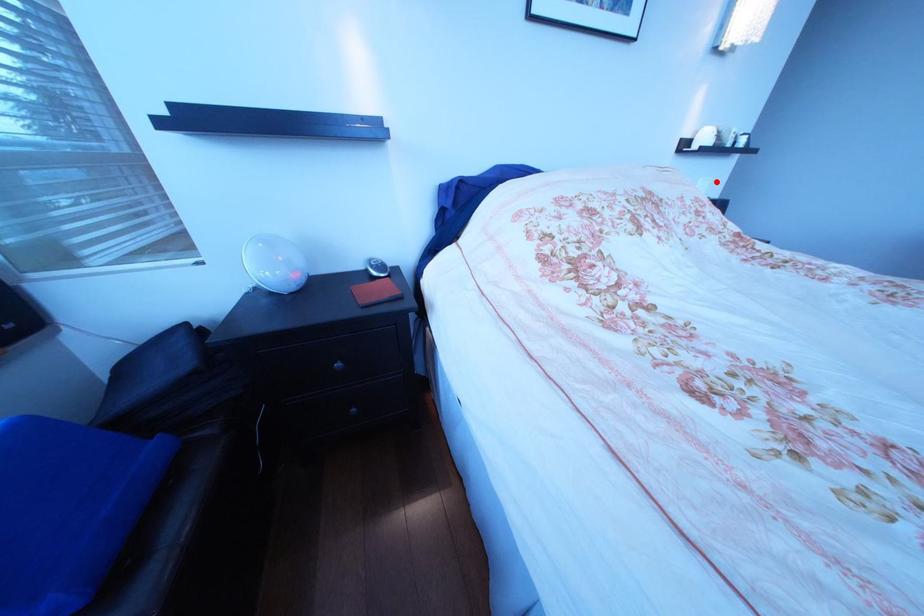
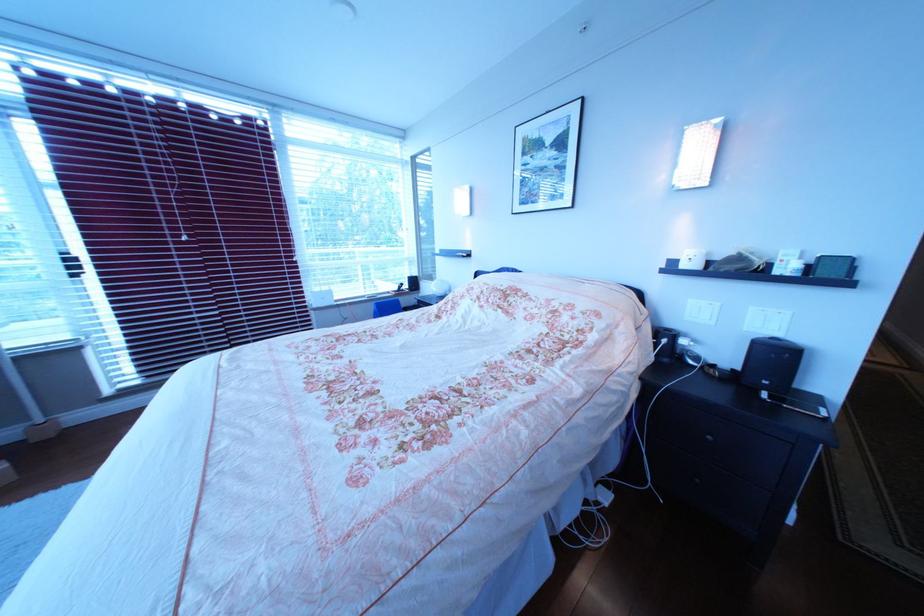
In the second image, find the point that corresponds to the highlighted location in the first image.

(767, 310)